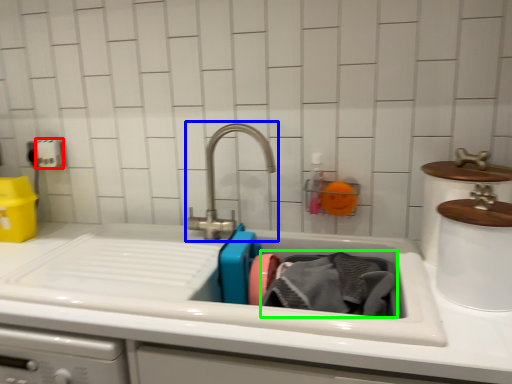
Question: Considering the real-world distances, which object is farthest from toilet paper (highlighted by a red box)? tap (highlighted by a blue box) or clothing (highlighted by a green box)?

Choices:
 (A) tap
 (B) clothing

Answer: (B)